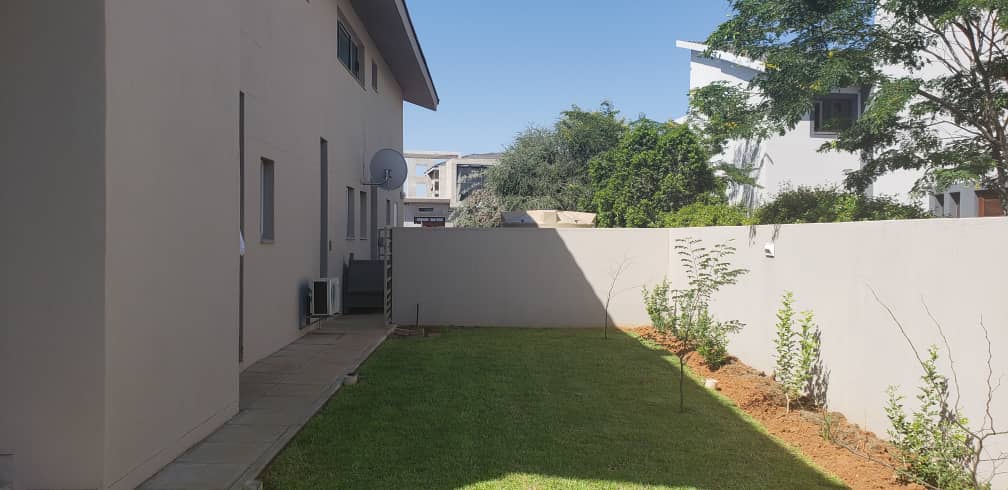
Identify the location of windows. (343, 45), (263, 211), (352, 211), (361, 207), (356, 57), (833, 114).